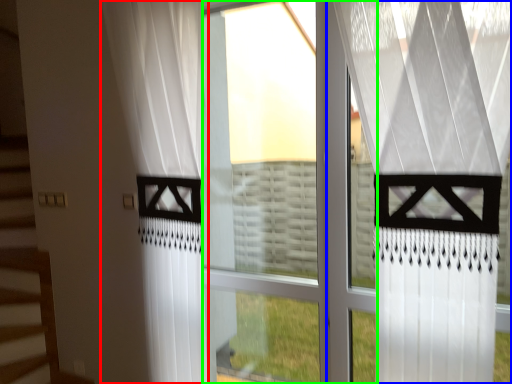
Question: Which object is positioned farthest from curtain (highlighted by a red box)? Select from curtain (highlighted by a blue box) and glass window (highlighted by a green box).

Choices:
 (A) curtain
 (B) glass window

Answer: (A)